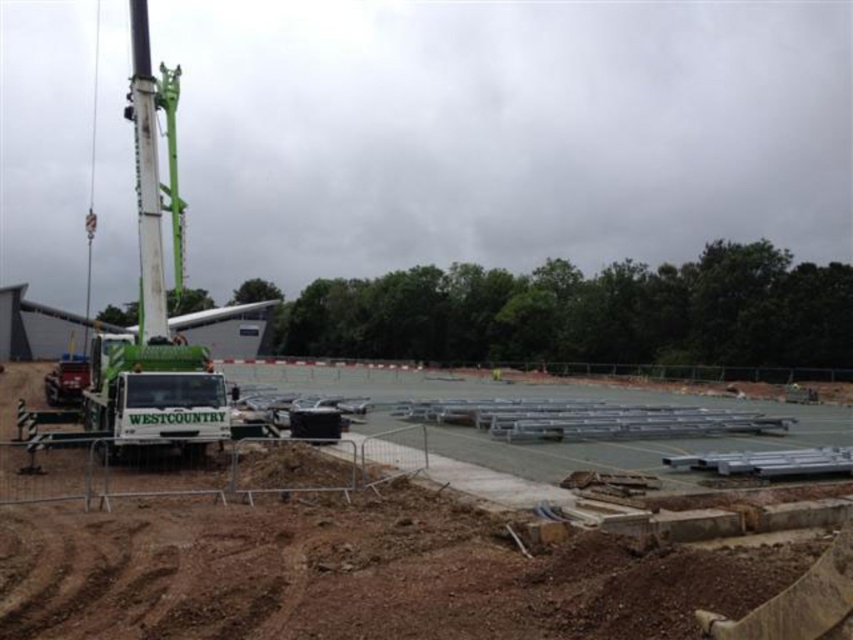
Question: Among these objects, which one is nearest to the camera?

Choices:
 (A) green matte trailer truck at lower left
 (B) white metallic scaffolding at center

Answer: (B)

Question: Does white metallic scaffolding at center appear over green matte trailer truck at lower left?

Choices:
 (A) yes
 (B) no

Answer: (B)

Question: Where is white metallic scaffolding at center located in relation to green matte trailer truck at lower left in the image?

Choices:
 (A) above
 (B) below

Answer: (B)

Question: Can you confirm if white metallic scaffolding at center is positioned to the right of green matte trailer truck at lower left?

Choices:
 (A) no
 (B) yes

Answer: (B)

Question: Which object appears closest to the camera in this image?

Choices:
 (A) green matte trailer truck at lower left
 (B) white metallic scaffolding at center

Answer: (B)